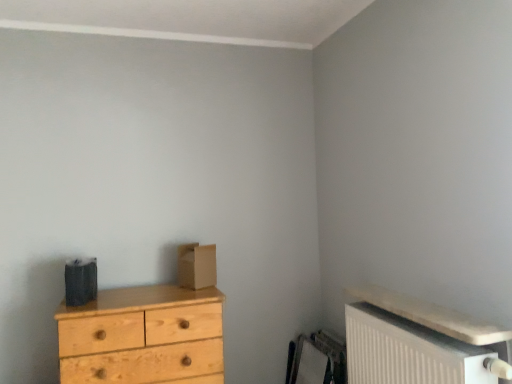
Question: Is white textured radiator at lower right at the back of brown cardboard box at center?

Choices:
 (A) no
 (B) yes

Answer: (A)

Question: From a real-world perspective, is brown cardboard box at center over white textured radiator at lower right?

Choices:
 (A) no
 (B) yes

Answer: (B)

Question: From a real-world perspective, is brown cardboard box at center physically below white textured radiator at lower right?

Choices:
 (A) yes
 (B) no

Answer: (B)

Question: Does brown cardboard box at center turn towards white textured radiator at lower right?

Choices:
 (A) yes
 (B) no

Answer: (B)

Question: Is brown cardboard box at center closer to camera compared to white textured radiator at lower right?

Choices:
 (A) yes
 (B) no

Answer: (B)

Question: In terms of width, does brown cardboard box at center look wider or thinner when compared to natural wood chest of drawers at left?

Choices:
 (A) wide
 (B) thin

Answer: (B)

Question: In the image, is brown cardboard box at center positioned in front of or behind natural wood chest of drawers at left?

Choices:
 (A) behind
 (B) front

Answer: (A)

Question: In terms of height, does brown cardboard box at center look taller or shorter compared to natural wood chest of drawers at left?

Choices:
 (A) tall
 (B) short

Answer: (B)

Question: From a real-world perspective, is brown cardboard box at center above or below natural wood chest of drawers at left?

Choices:
 (A) below
 (B) above

Answer: (B)

Question: From their relative heights in the image, would you say brown cardboard box at center is taller or shorter than white textured radiator at lower right?

Choices:
 (A) short
 (B) tall

Answer: (A)

Question: Is brown cardboard box at center in front of or behind white textured radiator at lower right in the image?

Choices:
 (A) front
 (B) behind

Answer: (B)

Question: In the image, is brown cardboard box at center on the left side or the right side of white textured radiator at lower right?

Choices:
 (A) left
 (B) right

Answer: (A)

Question: Is brown cardboard box at center bigger or smaller than white textured radiator at lower right?

Choices:
 (A) big
 (B) small

Answer: (B)

Question: From a real-world perspective, is white textured radiator at lower right positioned above or below natural wood chest of drawers at left?

Choices:
 (A) below
 (B) above

Answer: (B)

Question: From the image's perspective, relative to natural wood chest of drawers at left, is white textured radiator at lower right above or below?

Choices:
 (A) above
 (B) below

Answer: (A)